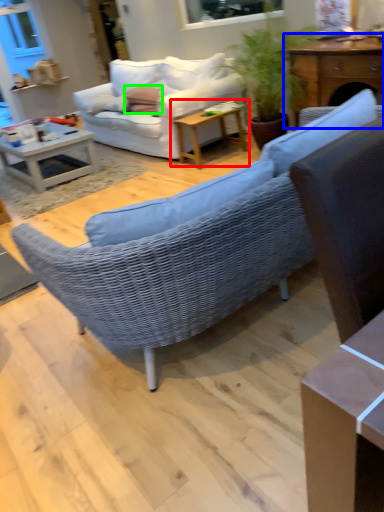
Question: Which is farther away from table (highlighted by a red box)? table (highlighted by a blue box) or pillow (highlighted by a green box)?

Choices:
 (A) table
 (B) pillow

Answer: (A)